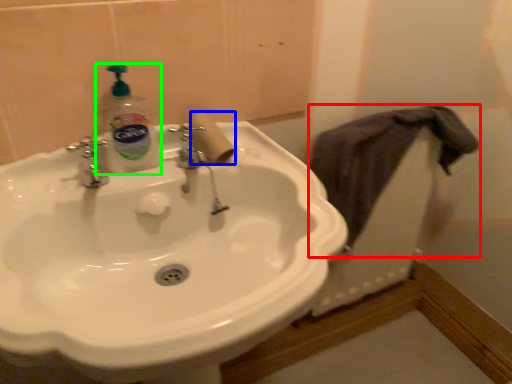
Question: Estimate the real-world distances between objects in this image. Which object is closer to bath towel (highlighted by a red box), toilet paper (highlighted by a blue box) or cleaning product (highlighted by a green box)?

Choices:
 (A) toilet paper
 (B) cleaning product

Answer: (A)